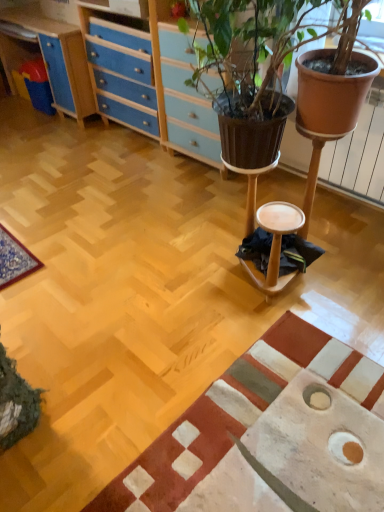
Question: Does textured beige rug at lower right lie behind wooden stool at center?

Choices:
 (A) yes
 (B) no

Answer: (B)

Question: From a real-world perspective, is textured beige rug at lower right over wooden stool at center?

Choices:
 (A) yes
 (B) no

Answer: (B)

Question: Can you confirm if textured beige rug at lower right is shorter than wooden stool at center?

Choices:
 (A) yes
 (B) no

Answer: (A)

Question: Is textured beige rug at lower right at the left side of wooden stool at center?

Choices:
 (A) no
 (B) yes

Answer: (B)

Question: From the image's perspective, is textured beige rug at lower right on top of wooden stool at center?

Choices:
 (A) yes
 (B) no

Answer: (B)

Question: From a real-world perspective, is textured beige rug at lower right positioned above or below blue wood/file cabinet at upper left?

Choices:
 (A) below
 (B) above

Answer: (A)

Question: Based on their sizes in the image, would you say textured beige rug at lower right is bigger or smaller than blue wood/file cabinet at upper left?

Choices:
 (A) big
 (B) small

Answer: (B)

Question: From their relative heights in the image, would you say textured beige rug at lower right is taller or shorter than blue wood/file cabinet at upper left?

Choices:
 (A) tall
 (B) short

Answer: (B)

Question: Is point (226, 416) positioned closer to the camera than point (94, 23)?

Choices:
 (A) closer
 (B) farther

Answer: (A)

Question: Is wooden stool at center bigger or smaller than blue wood/file cabinet at upper left?

Choices:
 (A) big
 (B) small

Answer: (B)

Question: Would you say wooden stool at center is inside or outside blue wood/file cabinet at upper left?

Choices:
 (A) inside
 (B) outside

Answer: (B)

Question: Is wooden stool at center in front of or behind blue wood/file cabinet at upper left in the image?

Choices:
 (A) behind
 (B) front

Answer: (B)

Question: In the image, is wooden stool at center on the left side or the right side of blue wood/file cabinet at upper left?

Choices:
 (A) left
 (B) right

Answer: (B)

Question: Is wooden stool at center bigger or smaller than textured beige rug at lower right?

Choices:
 (A) big
 (B) small

Answer: (B)

Question: From a real-world perspective, is wooden stool at center positioned above or below textured beige rug at lower right?

Choices:
 (A) above
 (B) below

Answer: (A)